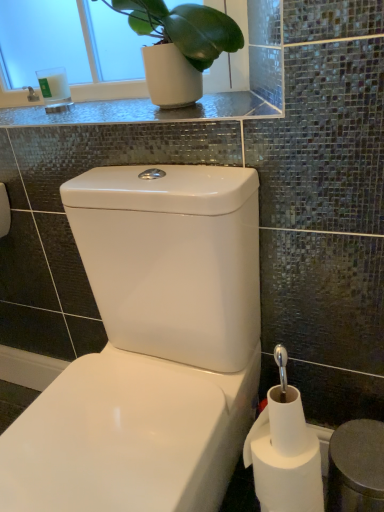
Question: Is white glossy toilet at center oriented towards green matte plant at upper left?

Choices:
 (A) no
 (B) yes

Answer: (A)

Question: Considering the relative sizes of white glossy toilet at center and green matte plant at upper left in the image provided, is white glossy toilet at center smaller than green matte plant at upper left?

Choices:
 (A) yes
 (B) no

Answer: (B)

Question: Is white glossy toilet at center taller than green matte plant at upper left?

Choices:
 (A) no
 (B) yes

Answer: (B)

Question: Is white glossy toilet at center not inside green matte plant at upper left?

Choices:
 (A) yes
 (B) no

Answer: (A)

Question: Is white glossy toilet at center closer to camera compared to green matte plant at upper left?

Choices:
 (A) yes
 (B) no

Answer: (A)

Question: Does white glossy toilet at center have a larger size compared to green matte plant at upper left?

Choices:
 (A) no
 (B) yes

Answer: (B)

Question: Are white glass candle at upper left and shiny glass countertop at upper center making contact?

Choices:
 (A) no
 (B) yes

Answer: (A)

Question: Can you confirm if white glass candle at upper left is taller than shiny glass countertop at upper center?

Choices:
 (A) yes
 (B) no

Answer: (A)

Question: Could you tell me if white glass candle at upper left is facing shiny glass countertop at upper center?

Choices:
 (A) no
 (B) yes

Answer: (A)

Question: Considering the relative positions of white glass candle at upper left and shiny glass countertop at upper center in the image provided, is white glass candle at upper left in front of shiny glass countertop at upper center?

Choices:
 (A) yes
 (B) no

Answer: (B)

Question: From the image's perspective, does white glass candle at upper left appear lower than shiny glass countertop at upper center?

Choices:
 (A) no
 (B) yes

Answer: (A)

Question: From a real-world perspective, is white glass candle at upper left on top of shiny glass countertop at upper center?

Choices:
 (A) yes
 (B) no

Answer: (A)

Question: Would you say green matte plant at upper left is part of shiny glass countertop at upper center's contents?

Choices:
 (A) yes
 (B) no

Answer: (B)